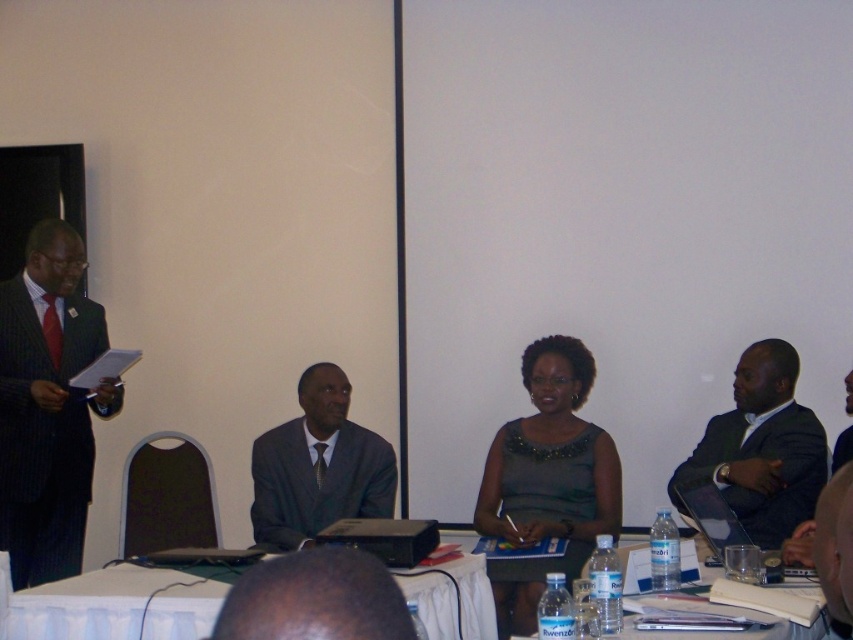
Is white cloth-covered table at lower center wider than dark gray suit at right?

Yes, white cloth-covered table at lower center is wider than dark gray suit at right.

Is point (4, 636) positioned after point (682, 513)?

That is False.

You are a GUI agent. You are given a task and a screenshot of the screen. Output one action in this format:
    pyautogui.click(x=<x>, y=<y>)
    Task: Click on the white cloth-covered table at lower center
    
    Given the screenshot: What is the action you would take?
    pyautogui.click(x=115, y=605)

Who is taller, green satin dress at center or white cloth-covered table at lower center?

Standing taller between the two is green satin dress at center.

Who is lower down, green satin dress at center or white cloth-covered table at lower center?

white cloth-covered table at lower center

Between point (549, 381) and point (96, 593), which one is positioned behind?

The point (549, 381) is behind.

Where is `green satin dress at center`? green satin dress at center is located at coordinates (547, 481).

In the scene shown: Between dark gray suit at right and dark gray suit at center, which one has more height?

Standing taller between the two is dark gray suit at right.

Between dark gray suit at right and dark gray suit at center, which one is positioned lower?

dark gray suit at center

Which is behind, point (772, 433) or point (306, 419)?

The point (306, 419) is behind.

This screenshot has width=853, height=640. In order to click on dark gray suit at right in this screenshot , I will do pyautogui.click(x=759, y=449).